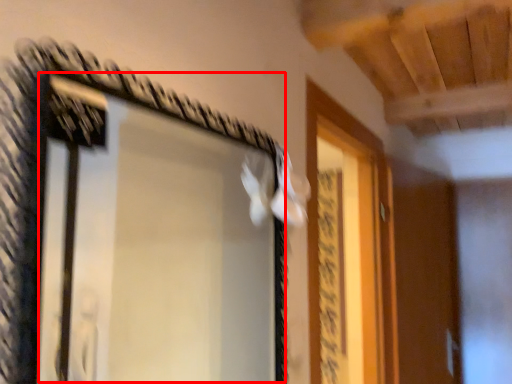
Question: In this image, where is window (annotated by the red box) located relative to screen door?

Choices:
 (A) right
 (B) left

Answer: (B)